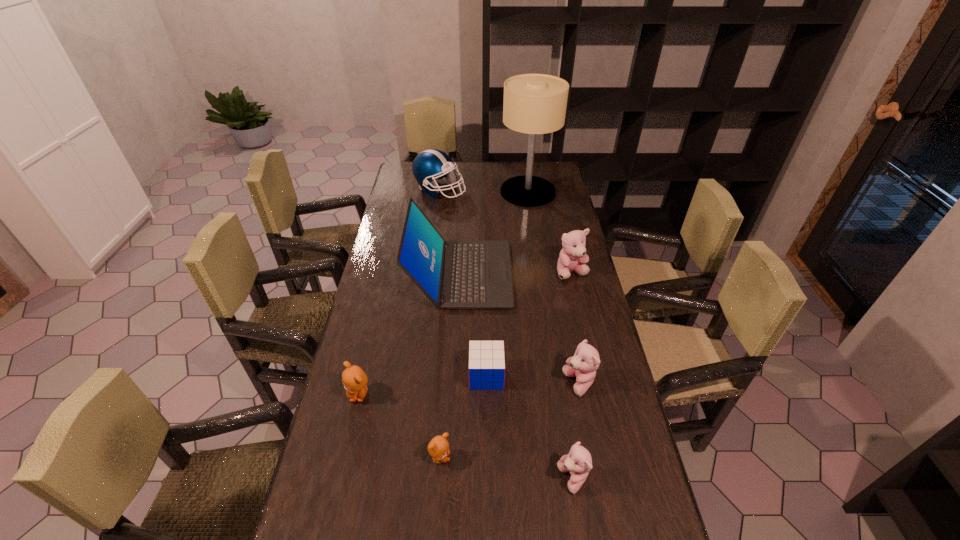
Identify the location of football helmet at the left edge. (430, 165).

The height and width of the screenshot is (540, 960). Find the location of `teddy bear located in the left edge section of the desktop`. teddy bear located in the left edge section of the desktop is located at coordinates (354, 379).

Where is `table lamp at the right edge`? table lamp at the right edge is located at coordinates pos(534,104).

Where is `object located in the far left corner section of the desktop`? The image size is (960, 540). object located in the far left corner section of the desktop is located at coordinates (430, 165).

This screenshot has height=540, width=960. Identify the location of object located at the far right corner. (534, 104).

Find the location of `free space at the far edge of the desktop`. free space at the far edge of the desktop is located at coordinates (473, 174).

What are the coordinates of `vacant position at the left edge of the desktop` in the screenshot? It's located at (320, 509).

Identify the location of free region at the right edge. click(x=592, y=284).

Find the location of a particular element. blank space at the far left corner is located at coordinates (418, 183).

In the image, there is a desktop. In order to click on vacant region at the far right corner in this screenshot , I will do `click(550, 166)`.